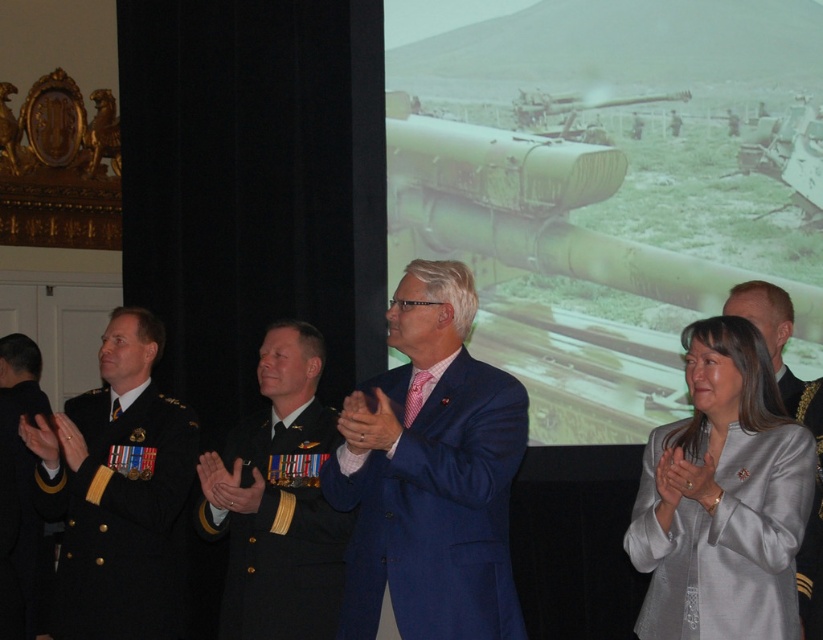
You are organizing a photo shoot and need to ensure that the silver satin blazer at lower right and the light brown uniform at center are visible in the frame. Given their sizes, which one might require more space in the photo composition?

The silver satin blazer at lower right is bigger than the light brown uniform at center, so it would require more space in the photo composition.

You are organizing a photo shoot and need to position two models wearing the dark blue fabric uniform at center and the black fabric uniform at right. The camera is set up at the back of the room. To ensure both models are in frame, what is the minimum distance in feet you should keep between them?

The minimum distance between the dark blue fabric uniform at center and the black fabric uniform at right should be 11.87 feet to ensure both are in frame when the camera is positioned at the back of the room.

In the scene shown: You are organizing a group photo and need to arrange two individuals based on the width of their uniforms. The dark blue fabric uniform at center and the black fabric uniform at right are the subjects. Which individual should stand on the left side to accommodate their uniform widths appropriately?

The dark blue fabric uniform at center should stand on the left side because its width is larger than the black fabric uniform at right, allowing more space for the wider uniform.